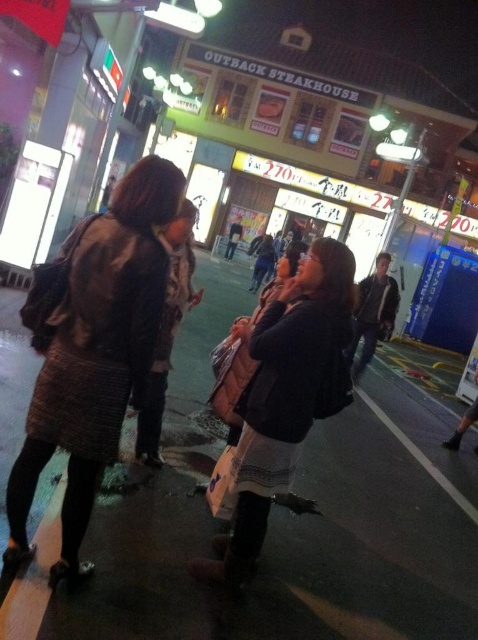
You are a delivery person who needs to avoid puddles while delivering a package to the Outback Steakhouse. According to the image, where exactly is the dark asphalt pavement at center located?

The dark asphalt pavement at center is located at point (290, 522).

You are a delivery person standing on the dark asphalt pavement at center holding a package. You need to place the package on the dark brown leather jacket at center. Is the jacket tall enough to hold the package without it falling off?

The dark asphalt pavement at center is shorter than the dark brown leather jacket at center, so the jacket is taller and can hold the package without it falling off.

You are a street performer who needs to choose a coat to wear during your performance. You have two options in front of you on the sidewalk at the center of the scene. Which coat is wider, the knitted wool coat at center or the dark brown leather jacket at center?

The knitted wool coat at center is wider than the dark brown leather jacket at center according to the description.